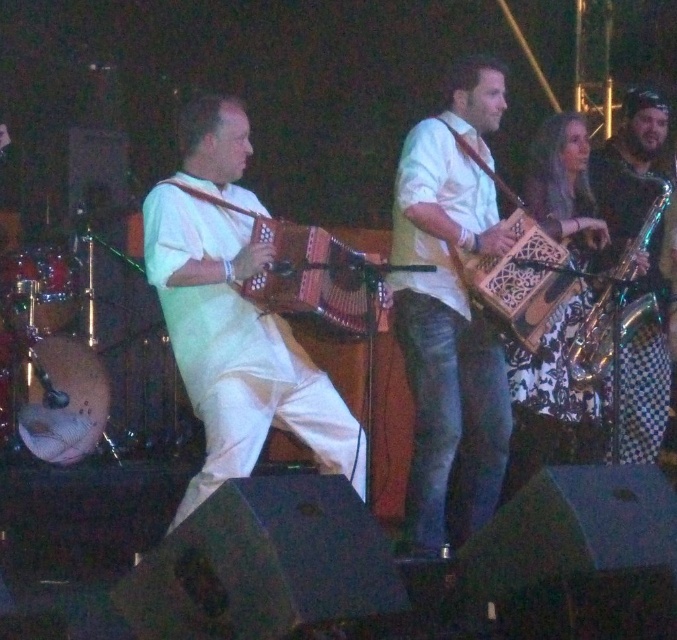
Question: In this image, where is matte white accordion at center located relative to gold metallic saxophone at right?

Choices:
 (A) left
 (B) right

Answer: (A)

Question: Which object is farther from the camera taking this photo?

Choices:
 (A) matte white accordion at center
 (B) wooden carved accordion at center
 (C) matte wooden accordion at left
 (D) gold metallic saxophone at right

Answer: (D)

Question: Is matte white accordion at center positioned at the back of matte wooden accordion at left?

Choices:
 (A) yes
 (B) no

Answer: (B)

Question: Which of the following is the closest to the observer?

Choices:
 (A) wooden carved accordion at center
 (B) matte white accordion at center
 (C) gold metallic saxophone at right
 (D) matte wooden accordion at left

Answer: (B)

Question: Is matte wooden accordion at left below wooden carved accordion at center?

Choices:
 (A) no
 (B) yes

Answer: (A)

Question: Which point is closer to the camera?

Choices:
 (A) (529, 300)
 (B) (271, 224)

Answer: (B)